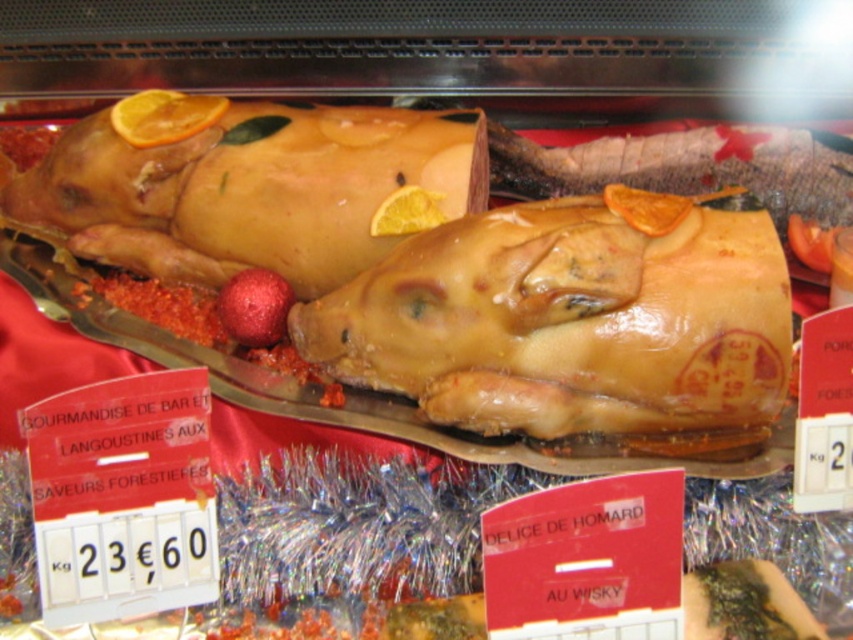
Question: Observing the image, what is the correct spatial positioning of shiny golden pig at center in reference to golden-brown roasted pig at center?

Choices:
 (A) above
 (B) below

Answer: (B)

Question: Can you confirm if shiny golden pig at center is bigger than golden-brown roasted pig at center?

Choices:
 (A) yes
 (B) no

Answer: (B)

Question: Does shiny golden pig at center appear over golden-brown roasted pig at center?

Choices:
 (A) yes
 (B) no

Answer: (B)

Question: Which of the following is the farthest from the observer?

Choices:
 (A) golden-brown roasted pig at center
 (B) shiny golden pig at center

Answer: (A)

Question: Which point appears farthest from the camera in this image?

Choices:
 (A) (422, 376)
 (B) (125, 132)

Answer: (B)